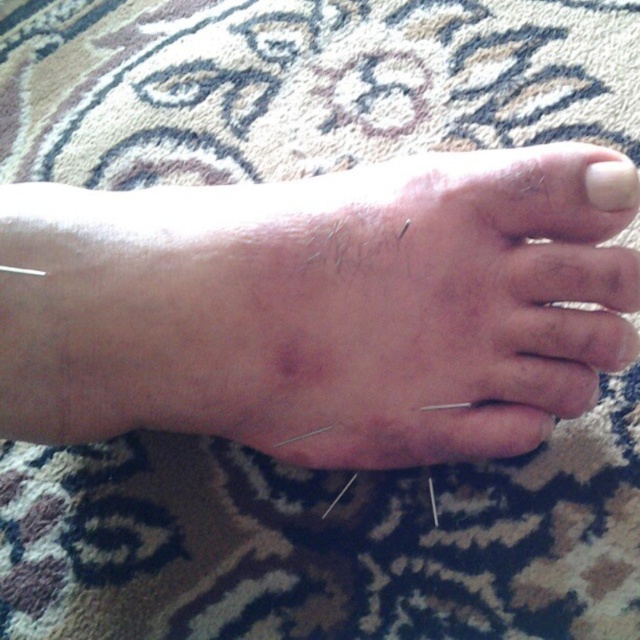
Question: Which point appears farthest from the camera in this image?

Choices:
 (A) (620, 164)
 (B) (182, 429)

Answer: (B)

Question: Is skin at center bigger than white matte nail at upper right?

Choices:
 (A) yes
 (B) no

Answer: (A)

Question: Which object is farther from the camera taking this photo?

Choices:
 (A) white matte nail at upper right
 (B) skin at center

Answer: (B)

Question: Can you confirm if skin at center is bigger than white matte nail at upper right?

Choices:
 (A) yes
 (B) no

Answer: (A)

Question: Is skin at center positioned before white matte nail at upper right?

Choices:
 (A) yes
 (B) no

Answer: (B)